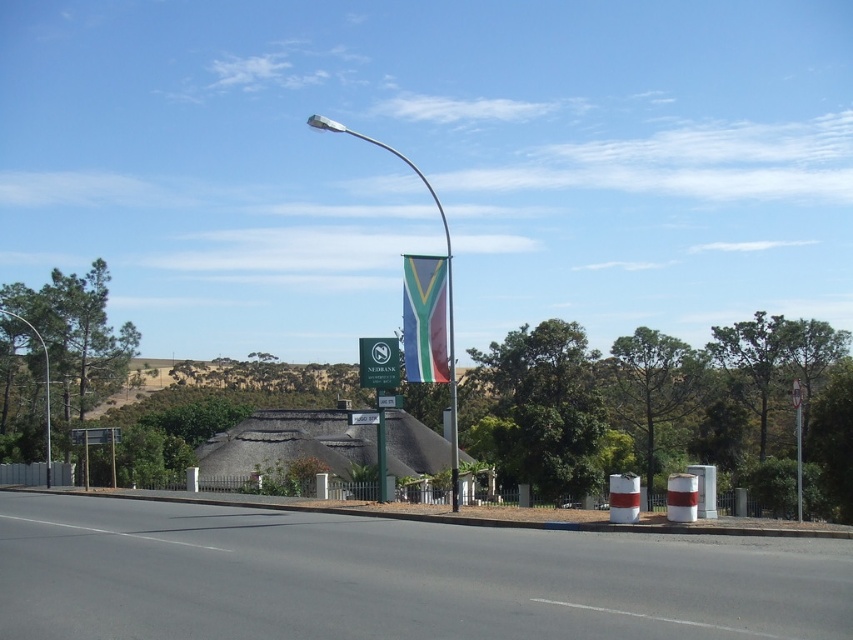
You are a photographer standing on the road and want to take a photo of the metallic pole at center and the polyester flag at center. Since you want to focus on the flag, which object should you position closer to the camera?

You should position the polyester flag at center closer to the camera because the metallic pole at center is behind it, so moving closer to the flag will keep it in focus while the pole may blur slightly.

You are a pedestrian standing on the road and want to reach the metallic pole at center. Which direction should you walk to avoid the polyester flag at center?

The polyester flag at center is on the right side of the metallic pole at center, so to avoid it, walk to the left side of the metallic pole at center.

You are a pedestrian standing at the edge of the road. You notice a polyester flag at center and a green plastic street sign at center. Which object is taller?

The polyester flag at center is taller than the green plastic street sign at center.